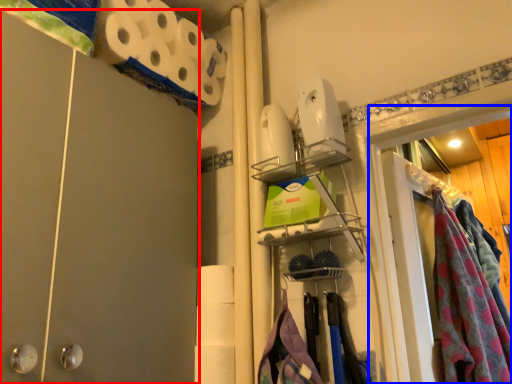
Question: Which point is further to the camera, barn door (highlighted by a red box) or glass door (highlighted by a blue box)?

Choices:
 (A) barn door
 (B) glass door

Answer: (B)